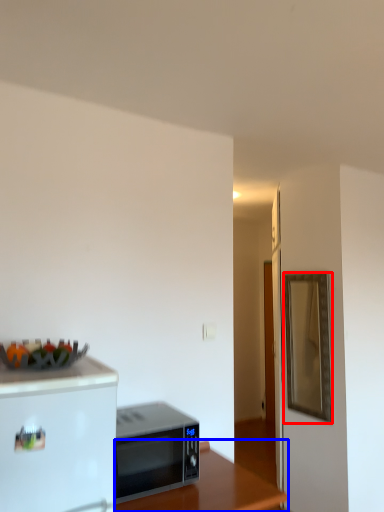
Question: Which of the following is the farthest to the observer, mirror (highlighted by a red box) or table (highlighted by a blue box)?

Choices:
 (A) mirror
 (B) table

Answer: (A)